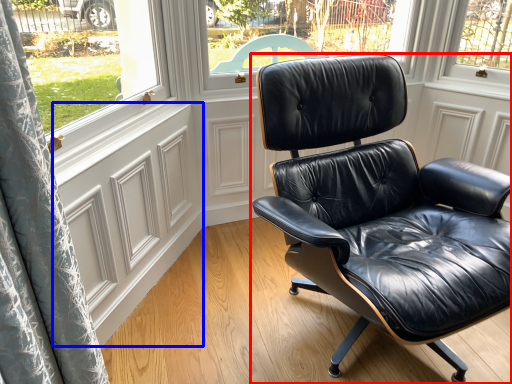
Question: Which point is closer to the camera, chair (highlighted by a red box) or screen door (highlighted by a blue box)?

Choices:
 (A) chair
 (B) screen door

Answer: (A)